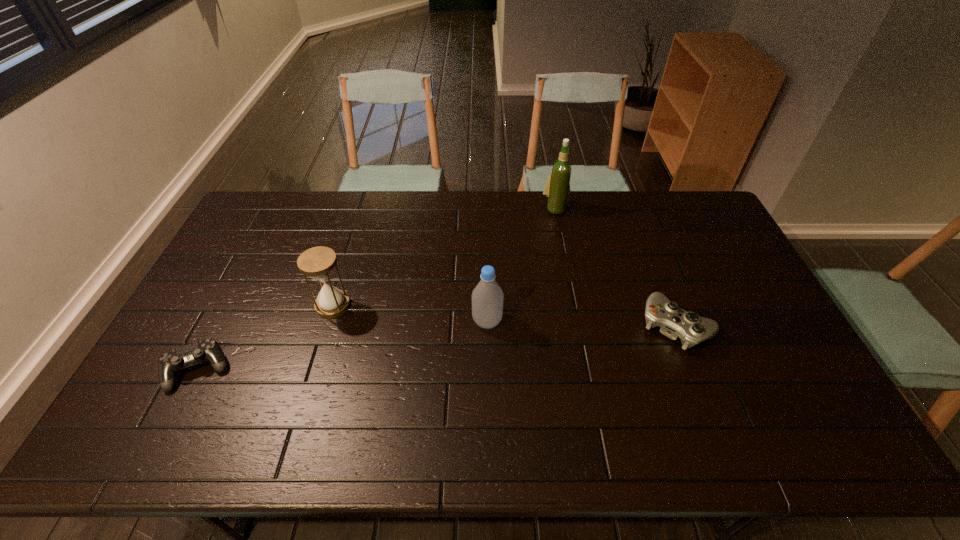
Where is `the fourth object from left to right`? The width and height of the screenshot is (960, 540). the fourth object from left to right is located at coordinates (557, 188).

Locate an element on the screen. This screenshot has width=960, height=540. the tallest object is located at coordinates (557, 188).

Where is `bottle`? bottle is located at coordinates (487, 297).

The width and height of the screenshot is (960, 540). I want to click on the fourth object from right to left, so click(318, 262).

This screenshot has width=960, height=540. Identify the location of the taller control. (675, 322).

The image size is (960, 540). Find the location of `the fourth tallest object`. the fourth tallest object is located at coordinates (675, 322).

Locate an element on the screen. This screenshot has width=960, height=540. the shortest object is located at coordinates (169, 363).

The height and width of the screenshot is (540, 960). I want to click on the shorter control, so click(169, 363).

Where is `vacant space located on the front-facing side of the fourth object from left to right`? vacant space located on the front-facing side of the fourth object from left to right is located at coordinates (567, 271).

Identify the location of free space located 0.300m on the left of the bottle. (369, 321).